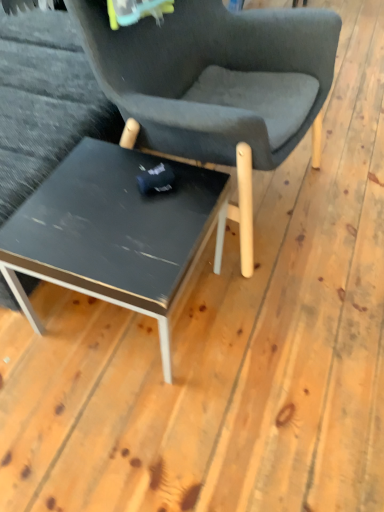
Locate an element on the screen. Image resolution: width=384 pixels, height=512 pixels. free space above matte black table at center (from a real-world perspective) is located at coordinates click(x=111, y=202).